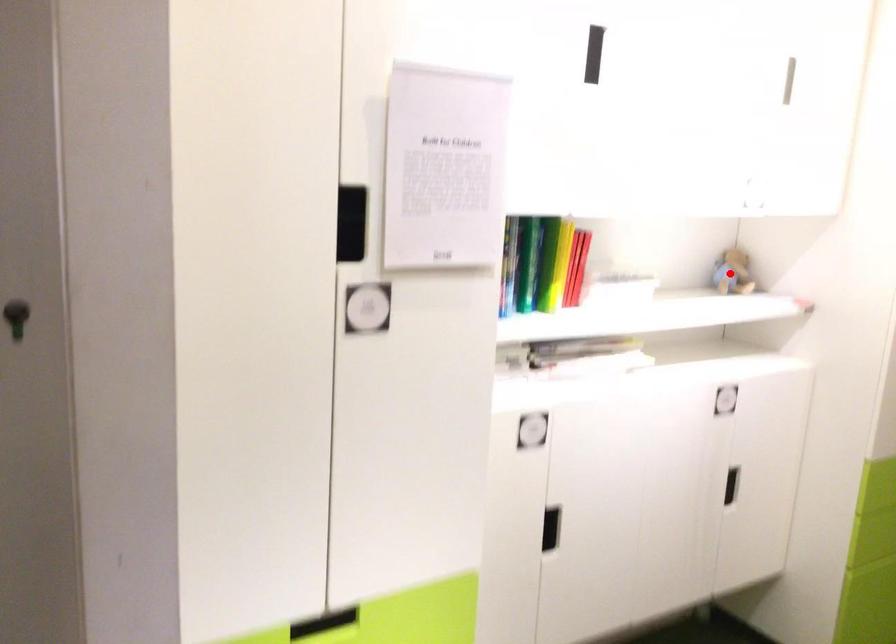
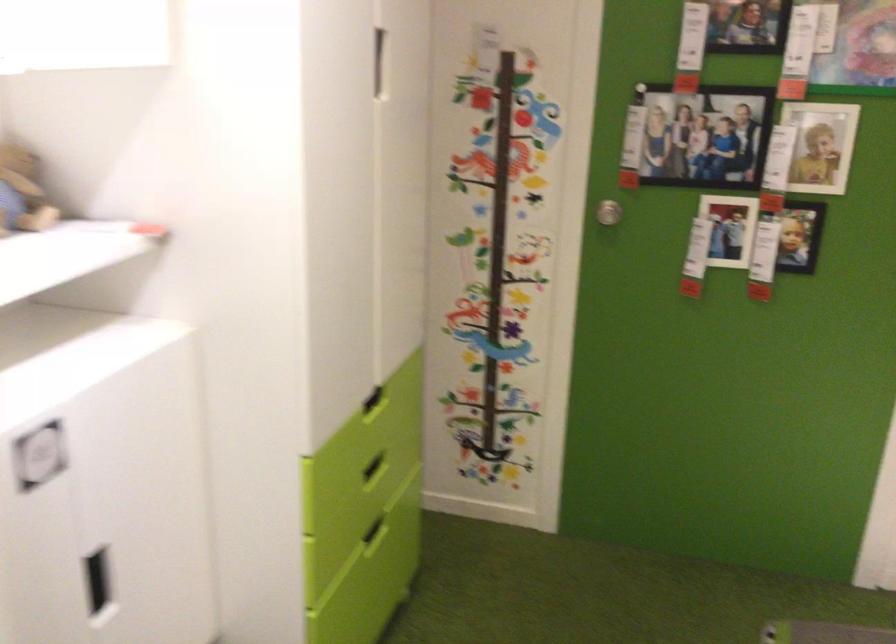
Question: I am providing you with two images of the same scene from different viewpoints. Image1 has a red point marked. In image2, the corresponding 3D location appears at what relative position? Reply with the corresponding letter.

Choices:
 (A) Closer
 (B) Farther

Answer: (A)